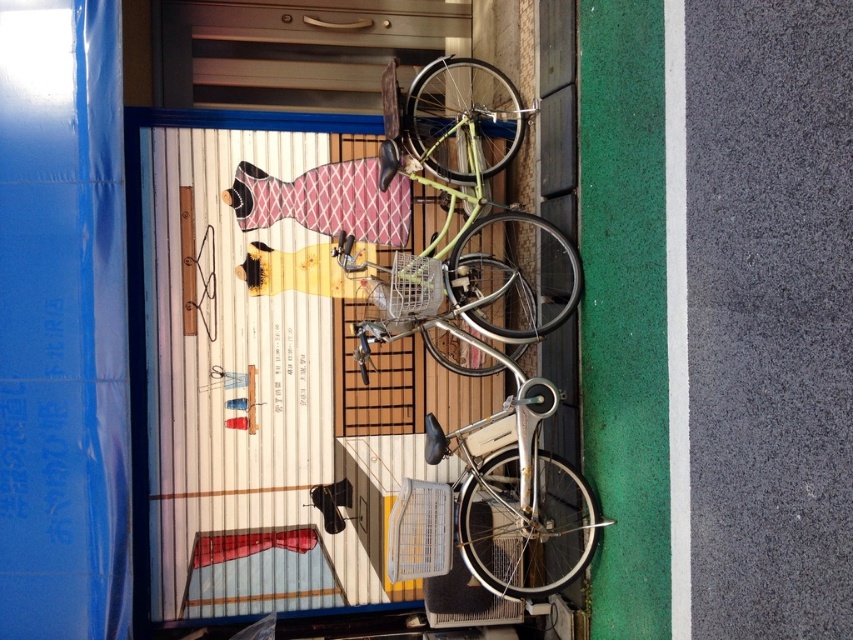
You are standing in front of the store and want to know which of the two points, point (413, 465) or point (418, 557), is closer to you. Based on the image, which point is nearer?

Point (413, 465) is closer to you because it is further to the viewer than point (418, 557).